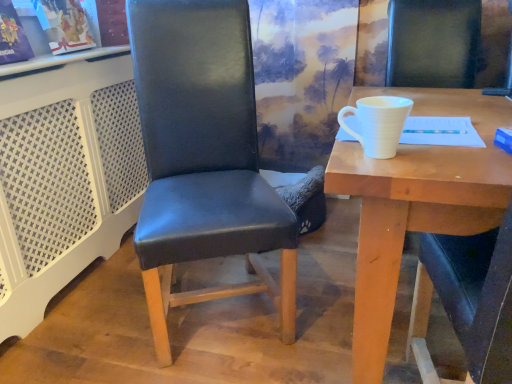
Find the location of `vacant area that is in front of white matte cup at right`. vacant area that is in front of white matte cup at right is located at coordinates (402, 167).